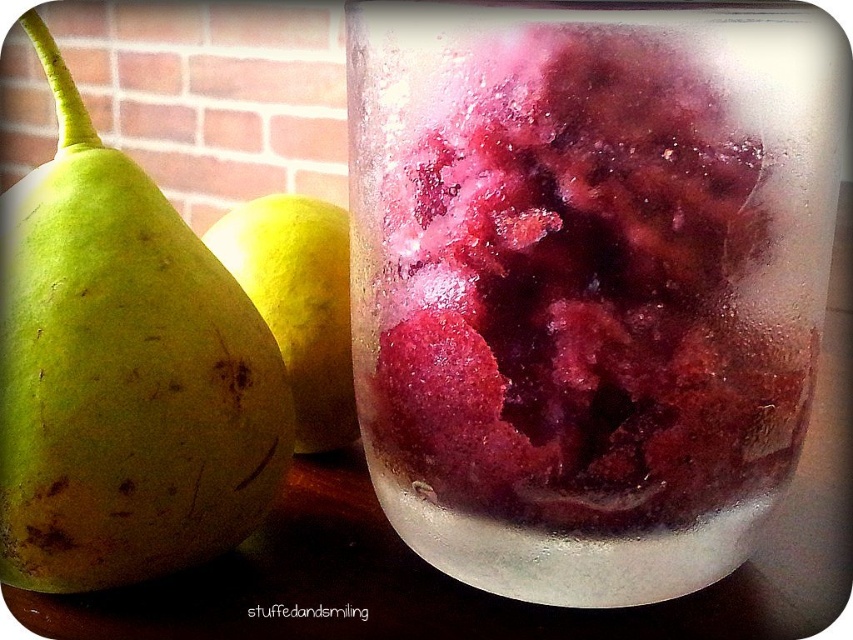
Question: Among these points, which one is farthest from the camera?

Choices:
 (A) (384, 152)
 (B) (322, 403)

Answer: (B)

Question: Estimate the real-world distances between objects in this image. Which object is closer to the frosted glass jar at center?

Choices:
 (A) green matte pear at left
 (B) yellow matte pear at center

Answer: (A)

Question: Is frosted glass jar at center positioned at the back of green matte pear at left?

Choices:
 (A) yes
 (B) no

Answer: (B)

Question: Can you confirm if frosted glass jar at center is smaller than green matte pear at left?

Choices:
 (A) no
 (B) yes

Answer: (A)

Question: Does frosted glass jar at center come in front of yellow matte pear at center?

Choices:
 (A) yes
 (B) no

Answer: (A)

Question: Which object is the closest to the yellow matte pear at center?

Choices:
 (A) green matte pear at left
 (B) frosted glass jar at center

Answer: (A)